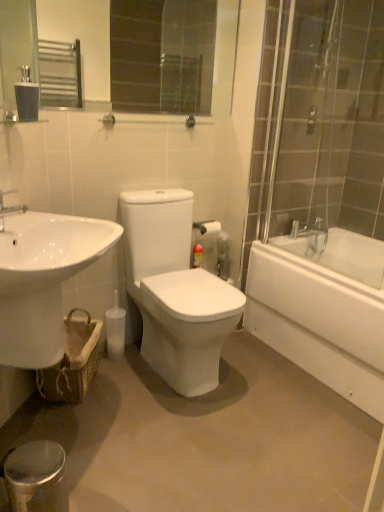
This screenshot has width=384, height=512. What are the coordinates of `glossy glass mirror at upper center` in the screenshot? It's located at [x=174, y=56].

Describe the element at coordinates (27, 96) in the screenshot. Image resolution: width=384 pixels, height=512 pixels. I see `matte black tissue at upper left` at that location.

Measure the distance between point (56, 288) and camera.

Point (56, 288) and camera are 4.67 feet apart from each other.

Describe the element at coordinates (323, 311) in the screenshot. I see `white glossy bathtub at right` at that location.

Where is `transparent glass shower door at right`? transparent glass shower door at right is located at coordinates (332, 120).

You are a GUI agent. You are given a task and a screenshot of the screen. Output one action in this format:
    pyautogui.click(x=<x>, y=<y>)
    Task: Click on the glossy glass mirror at upper center
    The width and height of the screenshot is (384, 512).
    Given the screenshot: What is the action you would take?
    pyautogui.click(x=174, y=56)

Does matte black tissue at upper left have a greater width compared to silver metallic faucet at upper left?

No.

From the image's perspective, is matte black tissue at upper left above or below silver metallic faucet at upper left?

matte black tissue at upper left is situated higher than silver metallic faucet at upper left in the image.

Who is smaller, matte black tissue at upper left or silver metallic faucet at upper left?

Smaller between the two is matte black tissue at upper left.

Is matte black tissue at upper left aimed at silver metallic faucet at upper left?

No, matte black tissue at upper left is not oriented towards silver metallic faucet at upper left.

How far apart are white glossy sink at lower left and silver metallic faucet at upper left?

white glossy sink at lower left and silver metallic faucet at upper left are 10.15 inches apart.

Image resolution: width=384 pixels, height=512 pixels. Find the location of `sink below the silver metallic faucet at upper left (from a real-world perspective)`. sink below the silver metallic faucet at upper left (from a real-world perspective) is located at coordinates (42, 279).

From a real-world perspective, is white glossy sink at lower left below silver metallic faucet at upper left?

Yes, from a real-world perspective, white glossy sink at lower left is under silver metallic faucet at upper left.

Based on their sizes in the image, would you say white glossy sink at lower left is bigger or smaller than silver metallic faucet at upper left?

white glossy sink at lower left is bigger than silver metallic faucet at upper left.

Which is in front, transparent glass shower door at right or matte black tissue at upper left?

transparent glass shower door at right is more forward.

From a real-world perspective, is transparent glass shower door at right located higher than matte black tissue at upper left?

Actually, transparent glass shower door at right is physically below matte black tissue at upper left in the real world.

Could you tell me if transparent glass shower door at right is facing matte black tissue at upper left?

Yes, transparent glass shower door at right faces towards matte black tissue at upper left.

Does point (4, 309) lie behind point (61, 66)?

No, it is not.

Can you tell me how much white glossy sink at lower left and glossy glass mirror at upper center differ in facing direction?

44 degrees.

Is white glossy sink at lower left spatially inside glossy glass mirror at upper center, or outside of it?

white glossy sink at lower left is not inside glossy glass mirror at upper center, it's outside.

Image resolution: width=384 pixels, height=512 pixels. I want to click on tap on the left of glossy glass mirror at upper center, so pos(9,209).

Between glossy glass mirror at upper center and silver metallic faucet at upper left, which one appears on the right side from the viewer's perspective?

glossy glass mirror at upper center.

Based on the photo, is glossy glass mirror at upper center behind silver metallic faucet at upper left?

Yes, it is behind silver metallic faucet at upper left.

From a real-world perspective, between glossy glass mirror at upper center and transparent glass shower door at right, who is vertically lower?

transparent glass shower door at right.

What's the angular difference between glossy glass mirror at upper center and transparent glass shower door at right's facing directions?

They differ by 90.4 degrees in their facing directions.

Is glossy glass mirror at upper center inside or outside of transparent glass shower door at right?

glossy glass mirror at upper center is located beyond the bounds of transparent glass shower door at right.

Which is closer, (134, 29) or (343, 53)?

Clearly, point (134, 29) is more distant from the camera than point (343, 53).

Considering the sizes of objects silver metallic faucet at upper left and white glossy bathtub at right in the image provided, who is bigger, silver metallic faucet at upper left or white glossy bathtub at right?

Bigger between the two is white glossy bathtub at right.

Can you confirm if silver metallic faucet at upper left is thinner than white glossy bathtub at right?

Yes.

Find the location of `tap in front of the white glossy bathtub at right`. tap in front of the white glossy bathtub at right is located at coordinates (9, 209).

This screenshot has width=384, height=512. What are the coordinates of `tissue behind the silver metallic faucet at upper left` in the screenshot? It's located at (27, 96).

The width and height of the screenshot is (384, 512). I want to click on sink that appears below the silver metallic faucet at upper left (from the image's perspective), so click(x=42, y=279).

Which object lies further to the anchor point white glossy sink at lower left, transparent glass shower door at right or glossy glass mirror at upper center?

Based on the image, glossy glass mirror at upper center appears to be further to white glossy sink at lower left.

Looking at the image, which one is located closer to transparent glass shower door at right, glossy glass mirror at upper center or matte black tissue at upper left?

matte black tissue at upper left.

Which object lies further to the anchor point glossy glass mirror at upper center, white glossy sink at lower left or silver metallic faucet at upper left?

silver metallic faucet at upper left lies further to glossy glass mirror at upper center than the other object.

When comparing their distances from transparent glass shower door at right, does white glossy sink at lower left or silver metallic faucet at upper left seem further?

Based on the image, silver metallic faucet at upper left appears to be further to transparent glass shower door at right.

Which object lies further to the anchor point matte black tissue at upper left, glossy glass mirror at upper center or white glossy bathtub at right?

glossy glass mirror at upper center lies further to matte black tissue at upper left than the other object.

Which object lies nearer to the anchor point transparent glass shower door at right, matte black tissue at upper left or white glossy sink at lower left?

white glossy sink at lower left is positioned closer to the anchor transparent glass shower door at right.

In the scene shown: Considering their positions, is glossy glass mirror at upper center positioned further to matte black tissue at upper left than white glossy sink at lower left?

The object further to matte black tissue at upper left is glossy glass mirror at upper center.

Considering their positions, is silver metallic faucet at upper left positioned closer to transparent glass shower door at right than white glossy sink at lower left?

white glossy sink at lower left is positioned closer to the anchor transparent glass shower door at right.

I want to click on sink between matte black tissue at upper left and white glossy bathtub at right from left to right, so click(x=42, y=279).

This screenshot has width=384, height=512. What are the coordinates of `sink between silver metallic faucet at upper left and transparent glass shower door at right in the horizontal direction` in the screenshot? It's located at (42, 279).

Image resolution: width=384 pixels, height=512 pixels. Identify the location of mirror located between matte black tissue at upper left and white glossy bathtub at right in the left-right direction. (174, 56).

The width and height of the screenshot is (384, 512). Find the location of `shower door situated between matte black tissue at upper left and white glossy bathtub at right from left to right`. shower door situated between matte black tissue at upper left and white glossy bathtub at right from left to right is located at coordinates (332, 120).